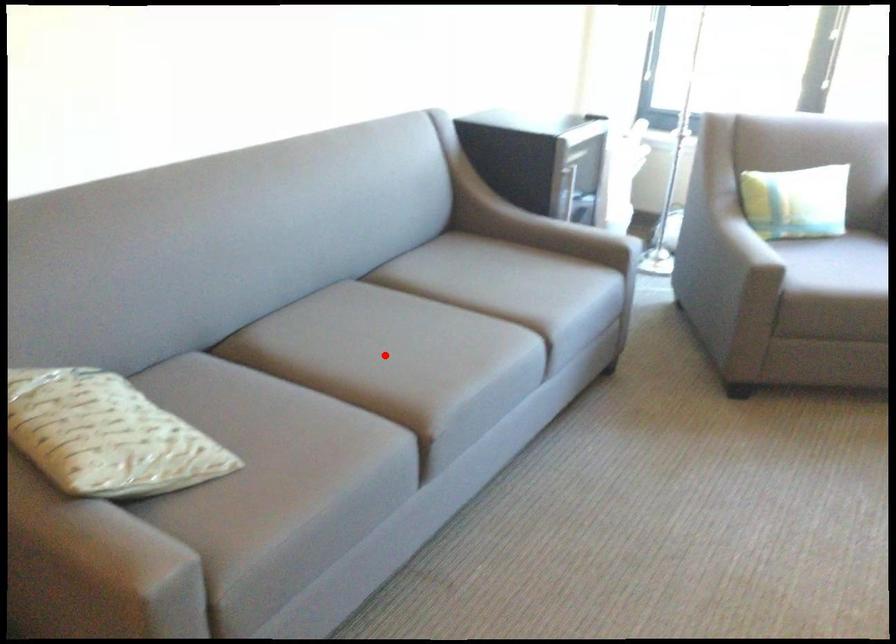
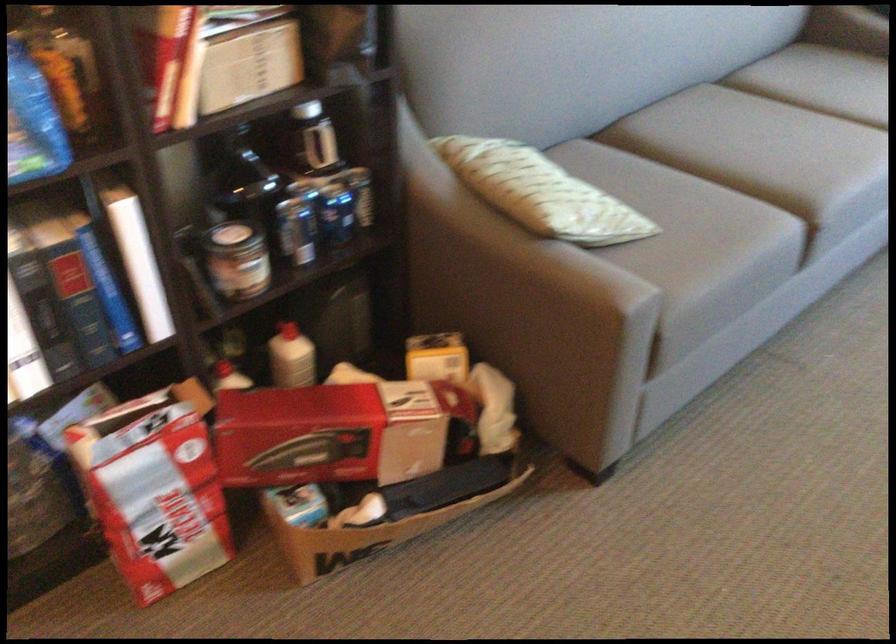
Question: I am providing you with two images of the same scene from different viewpoints. A red point is marked on the first image. Can you still see the location of the red point in image 2?

Choices:
 (A) Yes
 (B) No

Answer: (A)